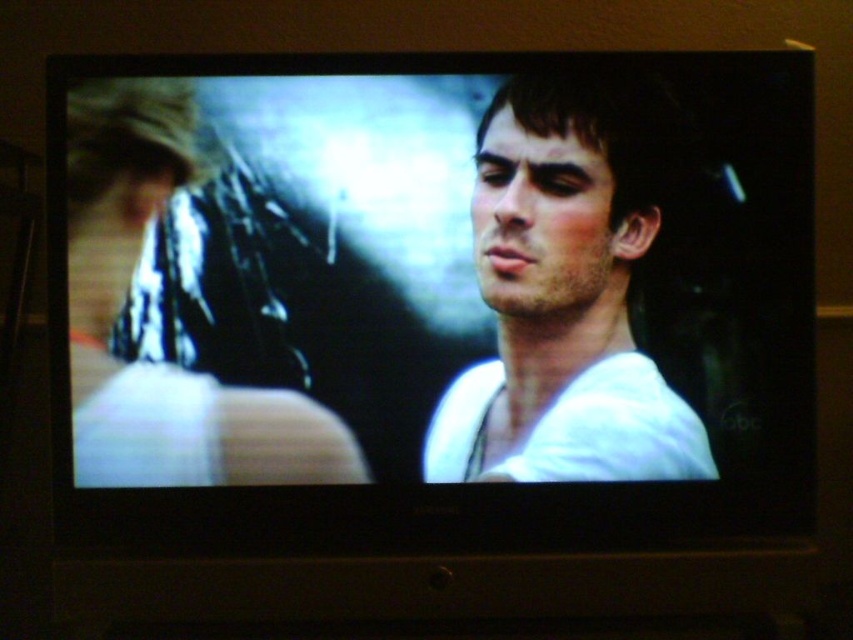
Does white matte screen at center have a lesser width compared to white matte shirt at center?

Incorrect, white matte screen at center's width is not less than white matte shirt at center's.

Which is below, white matte screen at center or white matte shirt at center?

white matte screen at center is lower down.

This screenshot has height=640, width=853. What do you see at coordinates (431, 300) in the screenshot?
I see `white matte screen at center` at bounding box center [431, 300].

Find the location of a particular element. The height and width of the screenshot is (640, 853). white matte screen at center is located at coordinates (431, 300).